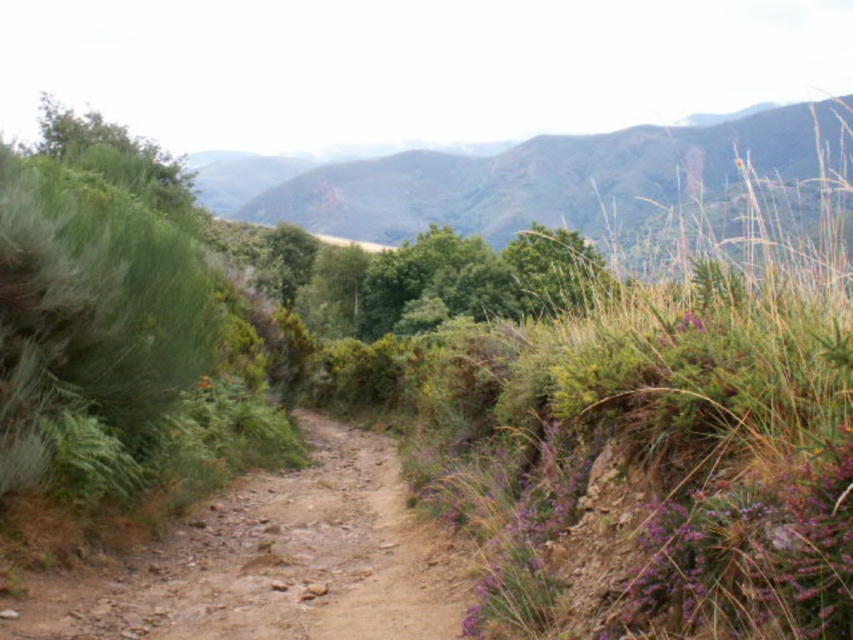
Question: Is brown dirt track at center thinner than green leafy tree at center?

Choices:
 (A) yes
 (B) no

Answer: (A)

Question: In this image, where is brown dirt track at center located relative to green leafy tree at center?

Choices:
 (A) above
 (B) below

Answer: (B)

Question: Is brown dirt track at center below green leafy tree at center?

Choices:
 (A) yes
 (B) no

Answer: (A)